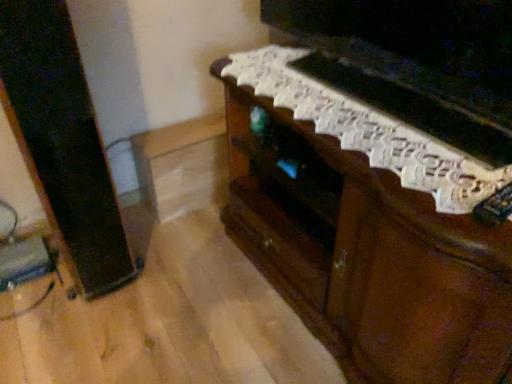
The width and height of the screenshot is (512, 384). Identify the location of empty space that is ontop of brown wooden tv stand at center (from a real-world perspective). (380, 124).